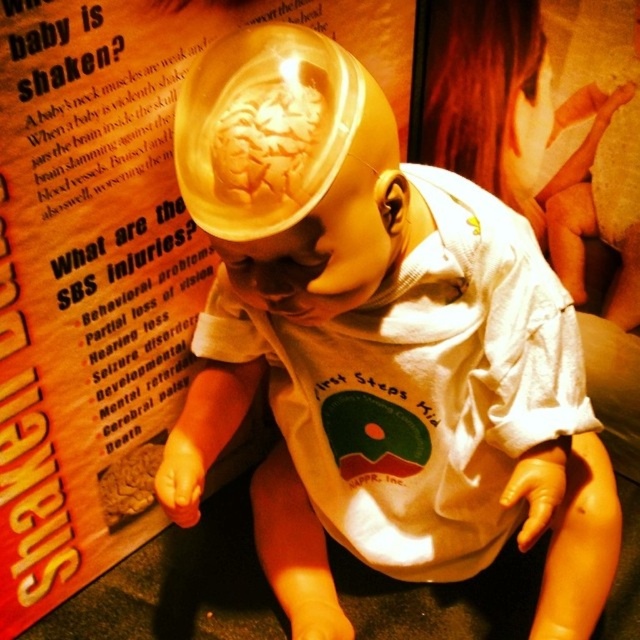
Based on the scene description, which object is shorter between the matte plastic head at center and the matte paper poster at center?

The matte plastic head at center is shorter than the matte paper poster at center.

From the picture: You are a teacher preparing a classroom display about shaken baby syndrome. You have a matte plastic head at center and a matte paper poster at center. If you want to place both items on a shelf, which item should you place first to ensure they fit side by side without overlapping?

The matte plastic head at center has a lesser width compared to the matte paper poster at center, so you should place the wider matte paper poster at center first to ensure they fit side by side without overlapping.